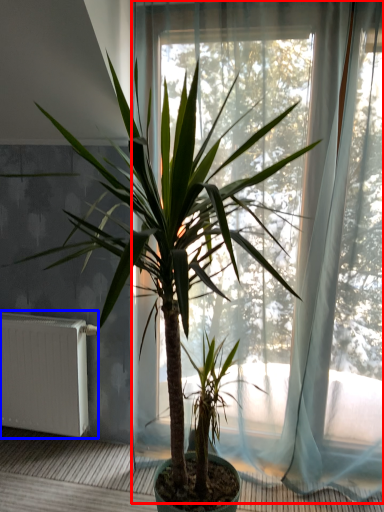
Question: Which point is further to the camera, window (highlighted by a red box) or radiator (highlighted by a blue box)?

Choices:
 (A) window
 (B) radiator

Answer: (B)